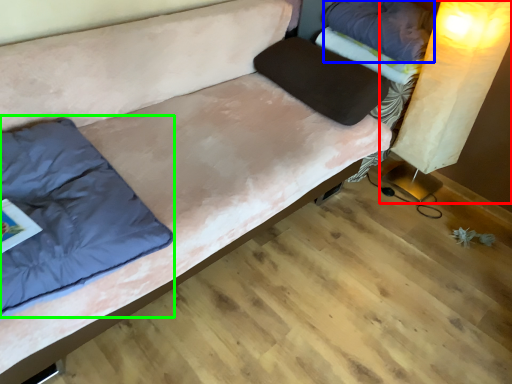
Question: Estimate the real-world distances between objects in this image. Which object is farther from table lamp (highlighted by a red box), pillow (highlighted by a blue box) or pillow (highlighted by a green box)?

Choices:
 (A) pillow
 (B) pillow

Answer: (B)